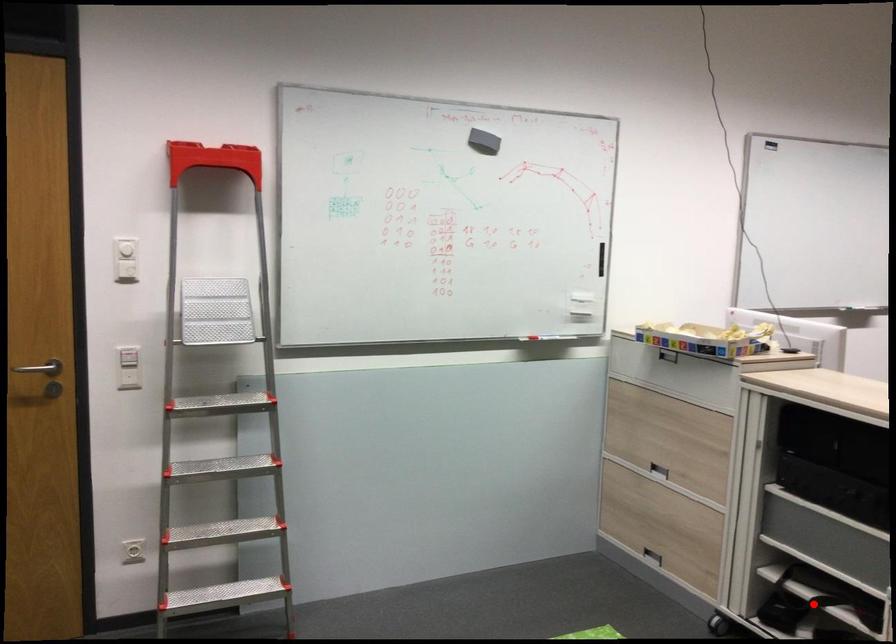
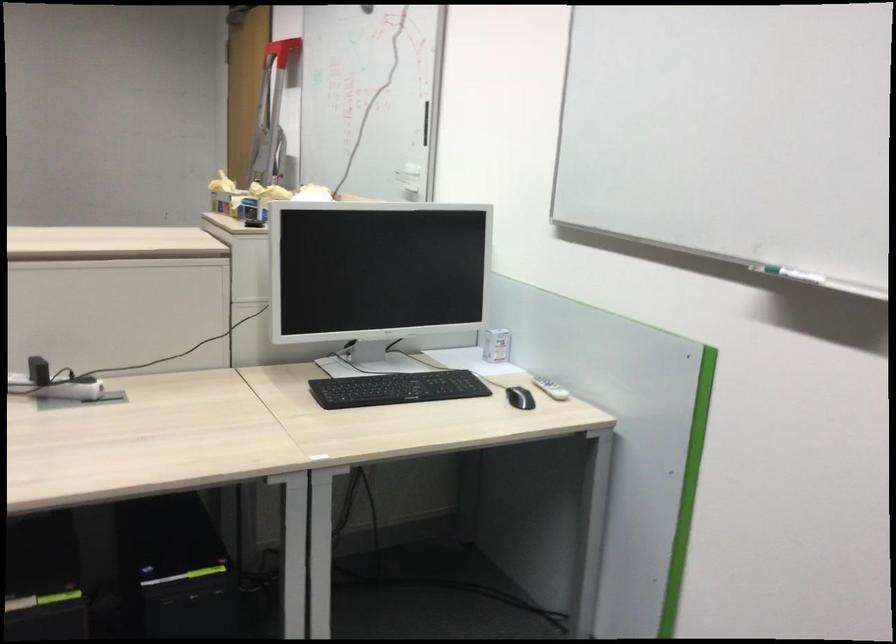
Question: I am providing you with two images of the same scene from different viewpoints. A red point is marked on the first image. At the location where the point appears in image 1, is it still visible in image 2?

Choices:
 (A) Yes
 (B) No

Answer: (B)